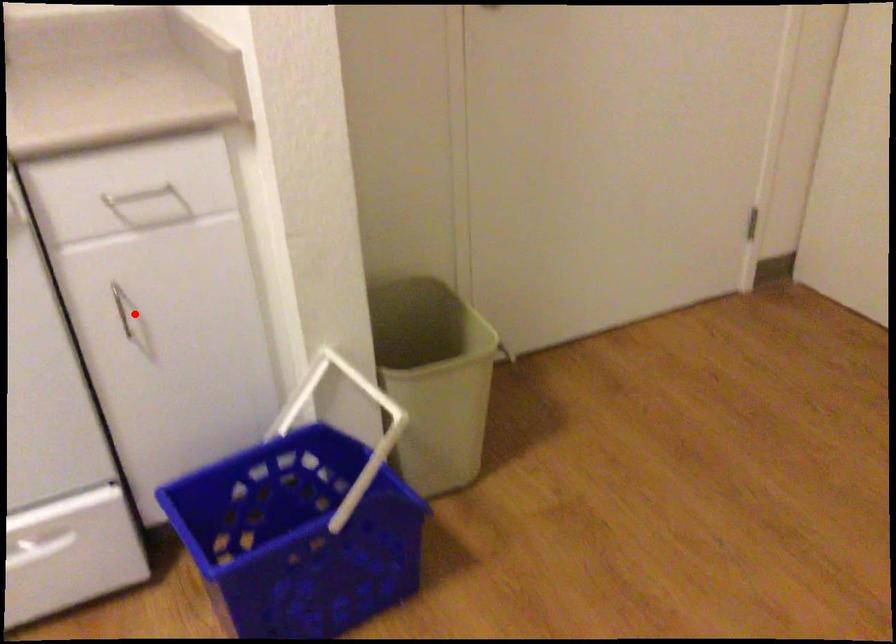
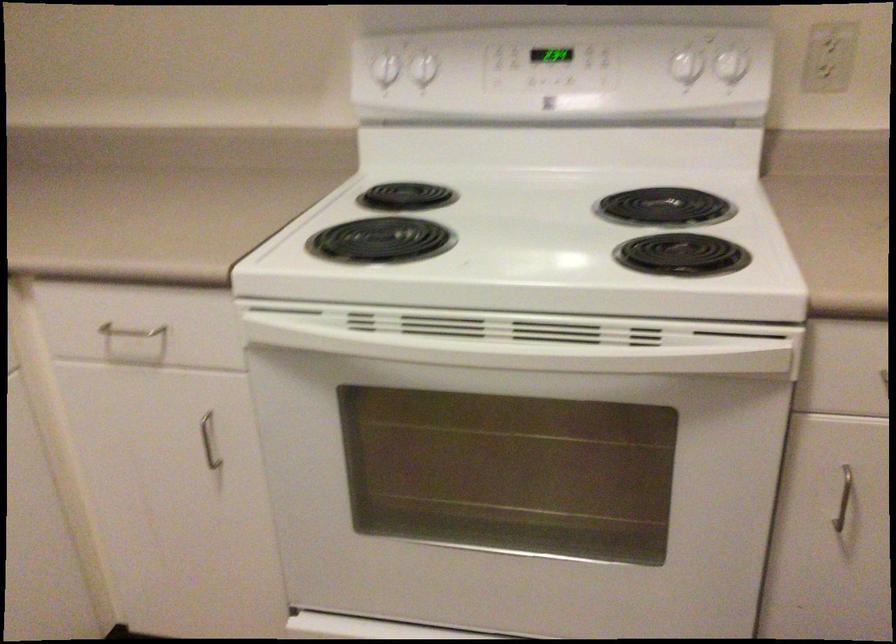
In the second image, find the point that corresponds to the highlighted location in the first image.

(842, 498)